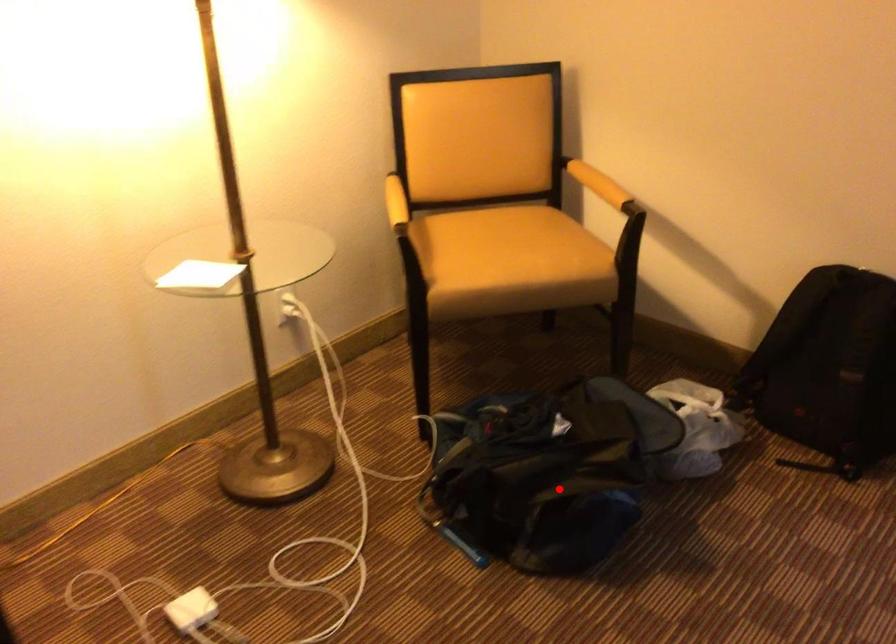
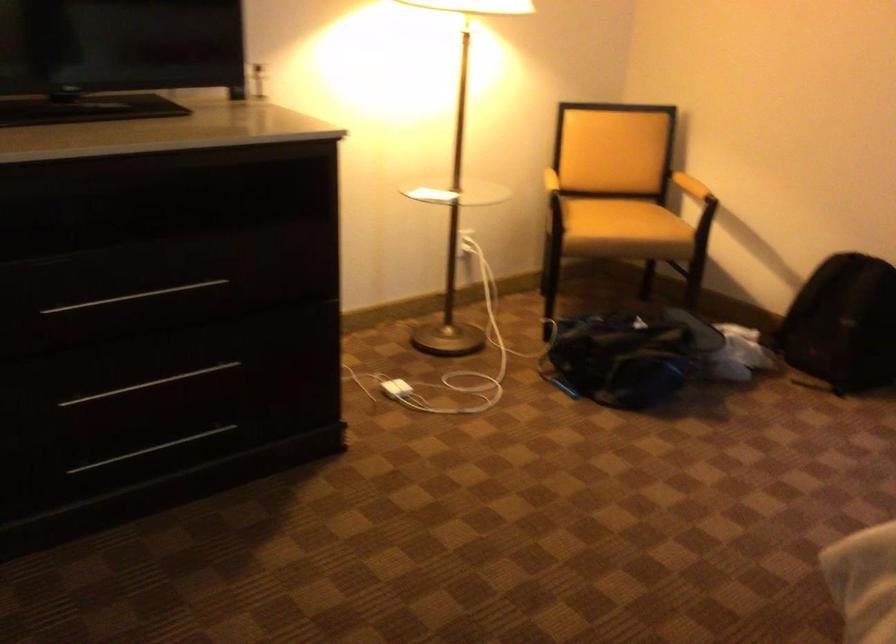
In the second image, find the point that corresponds to the highlighted location in the first image.

(627, 355)